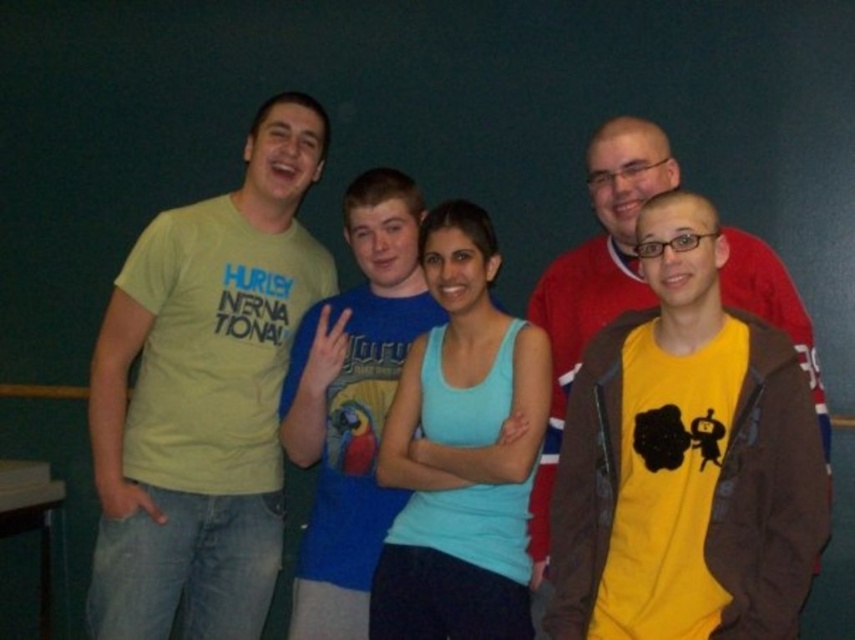
From the picture: You are trying to decide which shirt to buy between the light blue tank top at center and the yellow matte shirt at right. Based on the image, which one is wider?

The yellow matte shirt at right is wider than the light blue tank top at center.